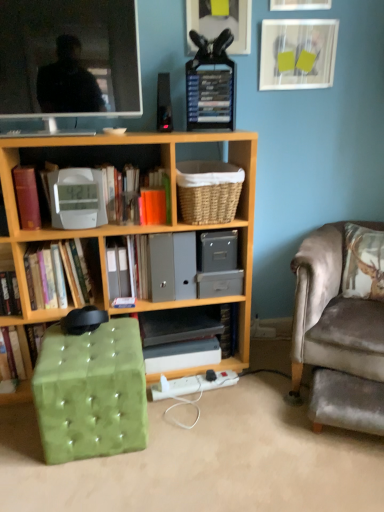
Question: In terms of height, does white plastic clock at center, the 2th book in the left-to-right sequence, look taller or shorter compared to velvet green footrest at lower right?

Choices:
 (A) tall
 (B) short

Answer: (A)

Question: Looking at the image, does white plastic clock at center, the 2th book in the left-to-right sequence, seem bigger or smaller compared to velvet green footrest at lower right?

Choices:
 (A) small
 (B) big

Answer: (B)

Question: Based on their relative distances, which object is nearer to the hardcover book at center-left, which appears as the 3th book when viewed from the right?

Choices:
 (A) hardcover books at upper center, the 1th paperback book positioned from the top
 (B) velvet green footrest at lower right
 (C) matte black screen at upper left
 (D) wooden bookcase at center
 (E) matte red book at left, placed as the 2th paperback book when sorted from top to bottom

Answer: (E)

Question: Which of these objects is positioned farthest from the wooden bookcase at center?

Choices:
 (A) orange matte paper at upper center, which is the third paperback book in top-to-bottom order
 (B) matte red book at left, which is counted as the first paperback book, starting from the left
 (C) velvet green footrest at lower right
 (D) hardcover book at center-left, the 1th book from the left
 (E) matte white picture frame at upper center, arranged as the 2th picture frame when viewed from the left

Answer: (E)